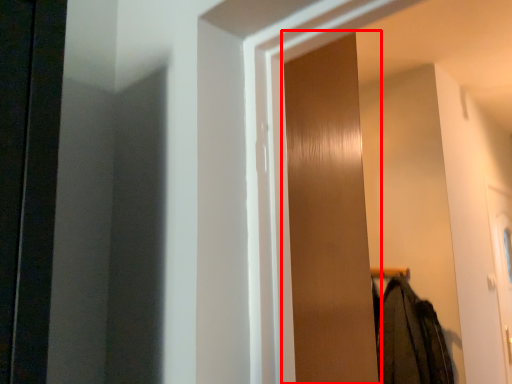
Question: From the image's perspective, what is the correct spatial relationship of screen door (annotated by the red box) in relation to clothing?

Choices:
 (A) below
 (B) above

Answer: (B)